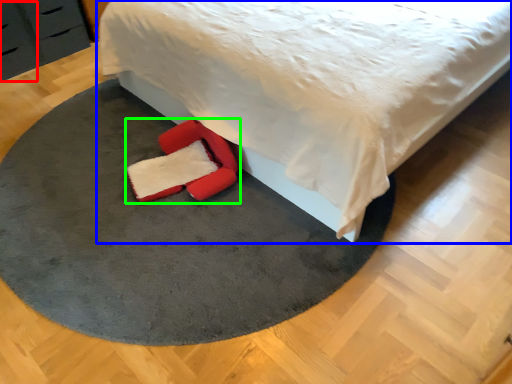
Question: Considering the real-world distances, which object is closest to drawer (highlighted by a red box)? bed (highlighted by a blue box) or footwear (highlighted by a green box).

Choices:
 (A) bed
 (B) footwear

Answer: (B)